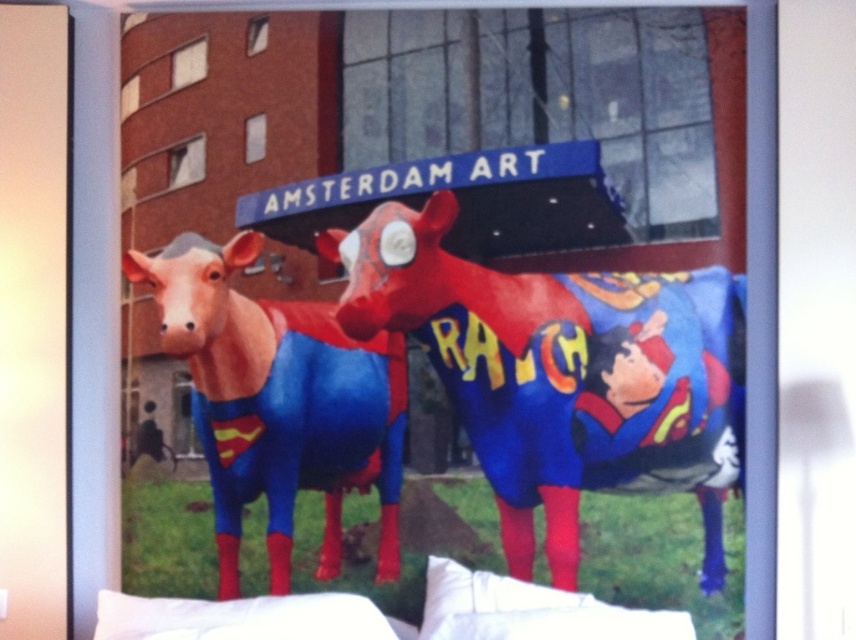
Question: Among these objects, which one is farthest from the camera?

Choices:
 (A) matte plastic bull at center
 (B) white fabric pillow at lower center

Answer: (A)

Question: Is matte plastic cow at center above white fabric pillow at lower center?

Choices:
 (A) no
 (B) yes

Answer: (B)

Question: Which of the following is the closest to the observer?

Choices:
 (A) matte plastic bull at center
 (B) white fabric pillow at lower center
 (C) matte plastic cow at center

Answer: (B)

Question: Based on their relative distances, which object is farther from the matte plastic cow at center?

Choices:
 (A) matte plastic bull at center
 (B) white fabric pillow at lower center

Answer: (A)

Question: Can you confirm if matte plastic bull at center is positioned below white fabric pillow at lower center?

Choices:
 (A) yes
 (B) no

Answer: (B)

Question: Does matte plastic cow at center come in front of matte plastic bull at center?

Choices:
 (A) no
 (B) yes

Answer: (B)